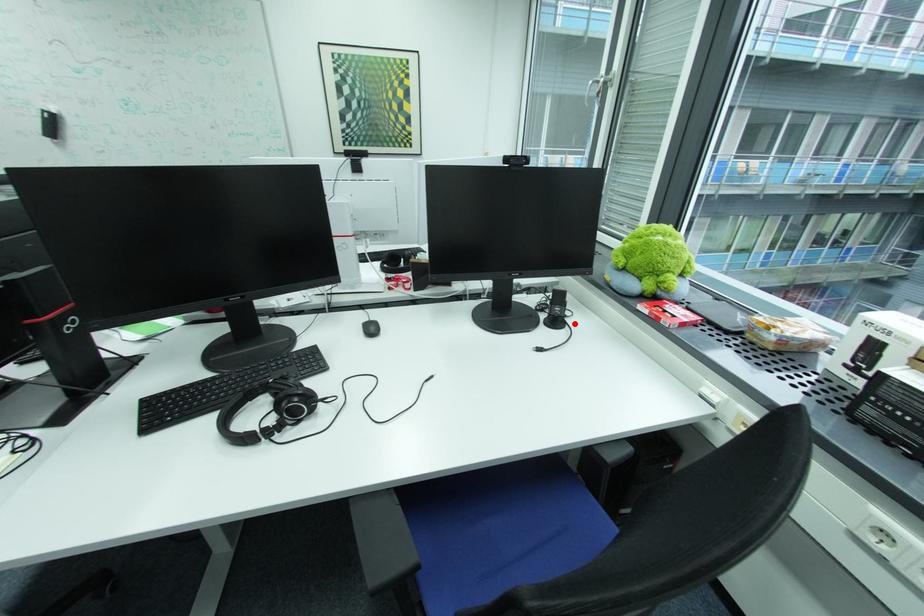
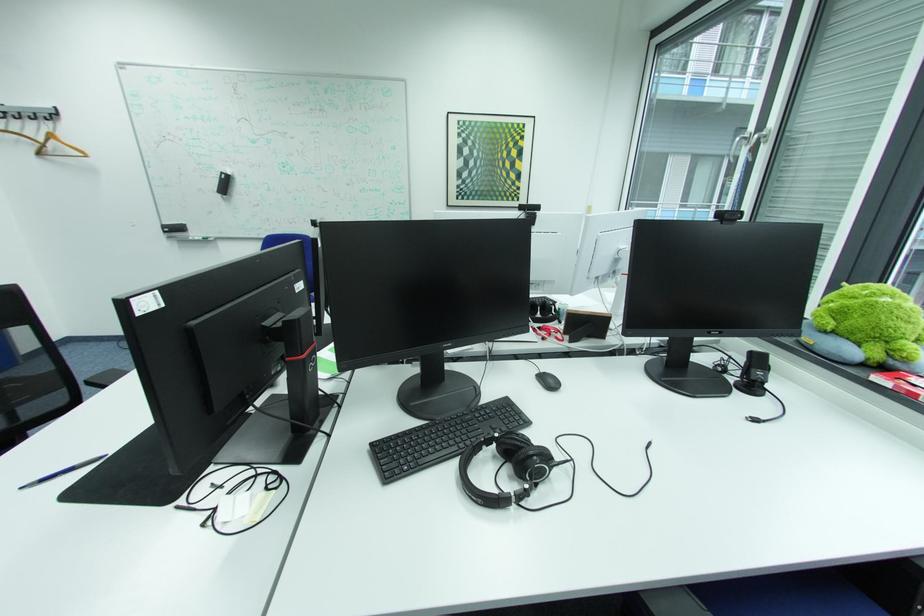
Find the pixel in the second image that matches the highlighted location in the first image.

(774, 390)